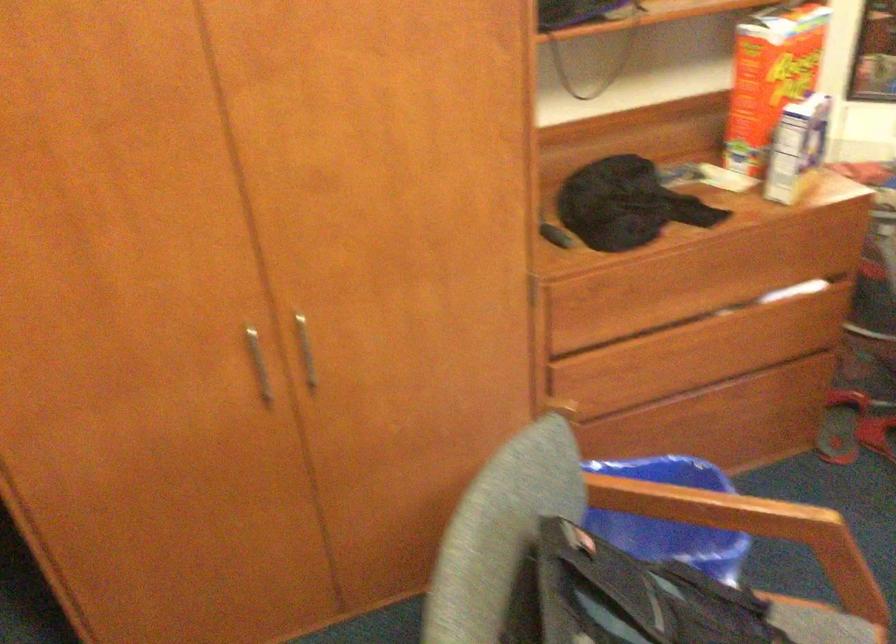
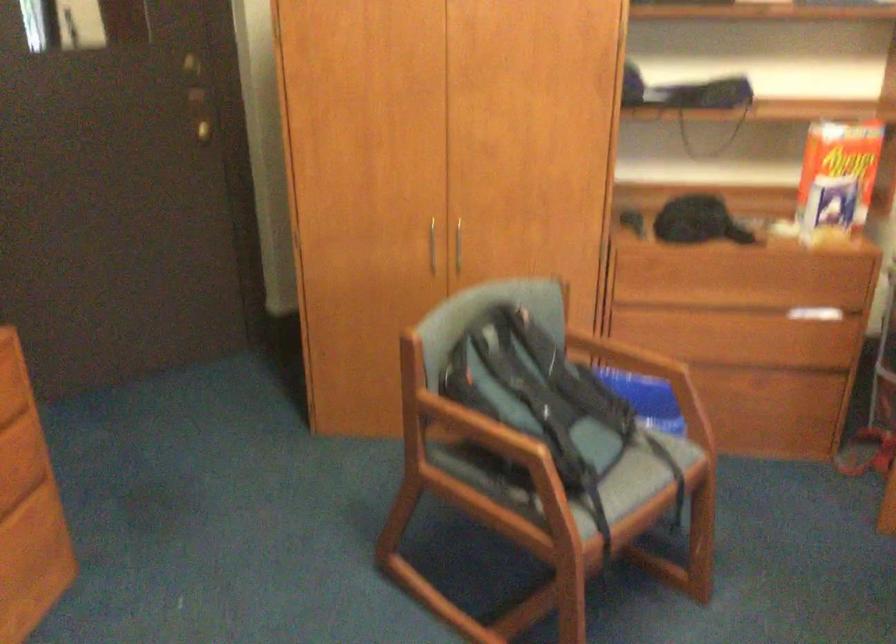
In a continuous first-person perspective shot, in which direction is the camera moving?

The movement direction of the cameraman is right, backward.